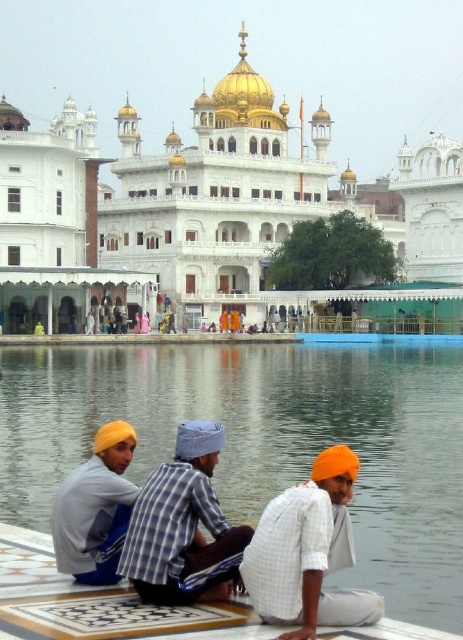
You are a tourist visiting the Golden Temple and want to take a photo of the orange matte turban at lower center and the clear water at lower center. Your camera has a maximum focus range of 30 meters. Can you capture both objects in one photo without moving your position?

The distance between the clear water at lower center and the orange matte turban at lower center is 30.85 meters. Since your camera can only focus up to 30 meters, you won t be able to capture both in one photo without moving.

In the scene shown: You are a photographer planning to capture a group photo of the orange matte turban at lower center and the yellow turban at lower left. Based on their positions, which turban will appear wider in the photo?

The orange matte turban at lower center will appear wider in the photo because its width surpasses that of the yellow turban at lower left.